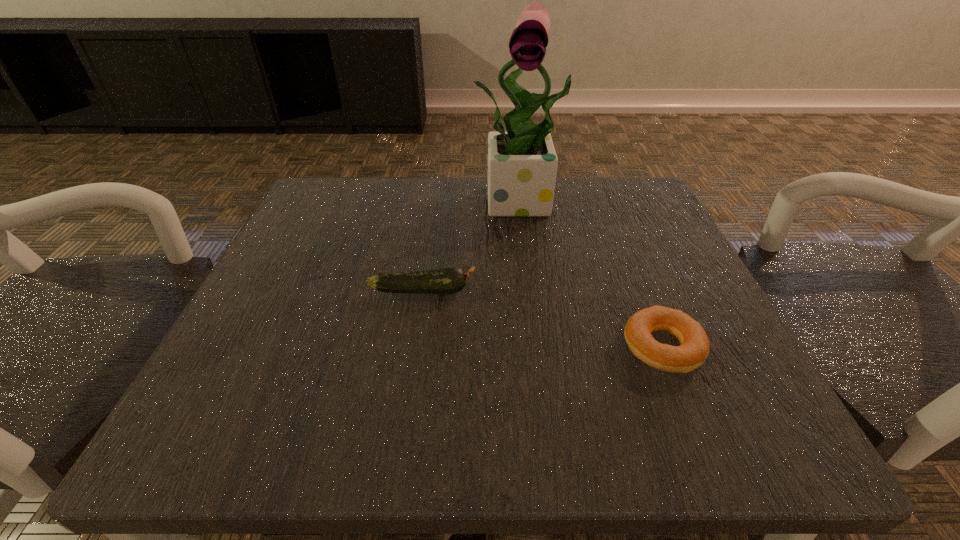
Where is `free space that is in between the farthest object and the zucchini`? free space that is in between the farthest object and the zucchini is located at coordinates (473, 245).

Locate an element on the screen. The width and height of the screenshot is (960, 540). empty space that is in between the tallest object and the zucchini is located at coordinates (473, 245).

Locate an element on the screen. The height and width of the screenshot is (540, 960). free spot between the zucchini and the tallest object is located at coordinates (473, 245).

Locate an element on the screen. This screenshot has width=960, height=540. free space between the tallest object and the second farthest object is located at coordinates (473, 245).

The image size is (960, 540). I want to click on free space between the zucchini and the tallest object, so click(473, 245).

This screenshot has width=960, height=540. I want to click on unoccupied area between the shortest object and the zucchini, so click(x=542, y=319).

At what (x,y) coordinates should I click in order to perform the action: click on free space between the rightmost object and the zucchini. Please return your answer as a coordinate pair (x, y). Looking at the image, I should click on (542, 319).

In order to click on vacant point located between the shortest object and the second nearest object in this screenshot , I will do `click(542, 319)`.

Identify which object is located as the nearest to the zucchini. Please provide its 2D coordinates. Your answer should be formatted as a tuple, i.e. [(x, y)], where the tuple contains the x and y coordinates of a point satisfying the conditions above.

[(522, 163)]

The width and height of the screenshot is (960, 540). I want to click on object that is the second nearest to the bagel, so click(x=522, y=163).